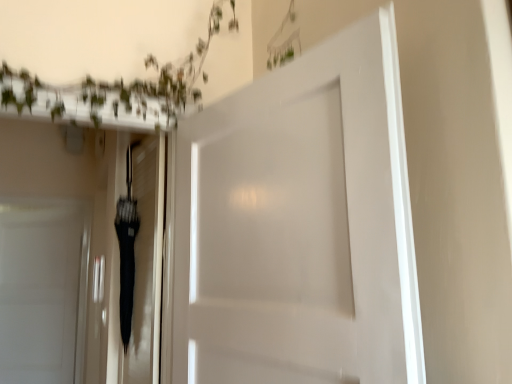
Where is `vacant space situated above white matte door at left, the second door when ordered from front to back (from a real-world perspective)`? This screenshot has width=512, height=384. vacant space situated above white matte door at left, the second door when ordered from front to back (from a real-world perspective) is located at coordinates (35, 210).